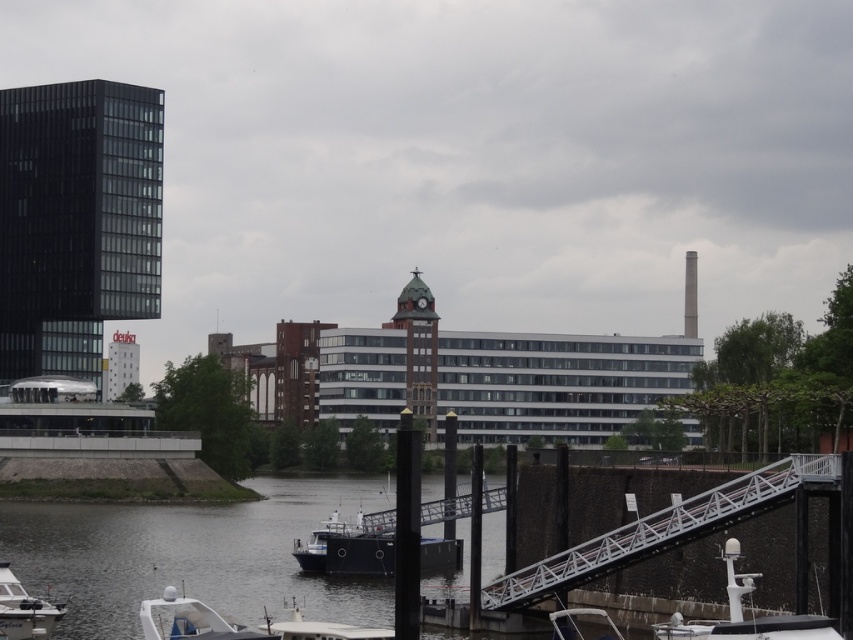
Question: Can you confirm if blue matte boat at lower center is positioned to the right of smooth concrete chimney at upper right?

Choices:
 (A) no
 (B) yes

Answer: (A)

Question: Which point is farther to the camera?

Choices:
 (A) (334, 518)
 (B) (422, 298)
 (C) (15, 374)

Answer: (B)

Question: Which point is farther from the camera taking this photo?

Choices:
 (A) (22, 156)
 (B) (695, 312)
 (C) (389, 616)

Answer: (B)

Question: Does white plastic boat at lower left appear over smooth concrete chimney at upper right?

Choices:
 (A) no
 (B) yes

Answer: (A)

Question: Observing the image, what is the correct spatial positioning of white matte radar at lower right in reference to white plastic boat at lower right?

Choices:
 (A) right
 (B) left

Answer: (A)

Question: Among these points, which one is farthest from the camera?

Choices:
 (A) (424, 288)
 (B) (20, 628)
 (C) (207, 516)

Answer: (A)